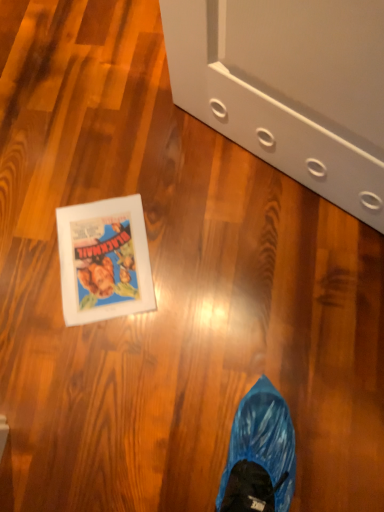
Image resolution: width=384 pixels, height=512 pixels. I want to click on free space in front of matte paper comic book at lower left, so click(x=110, y=366).